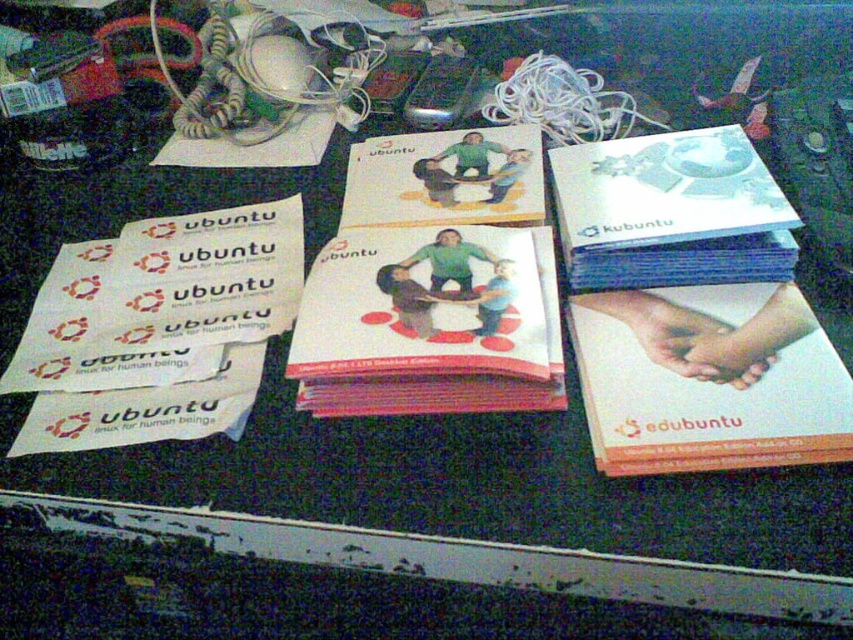
In the scene shown: Which is above, white matte paper at center right or white glossy book at upper right?

white glossy book at upper right

Between white matte paper at center right and white glossy book at upper right, which one has more height?

Standing taller between the two is white glossy book at upper right.

Is point (805, 330) in front of point (563, 200)?

Yes.

In order to click on white matte paper at center right in this screenshot , I will do `click(708, 380)`.